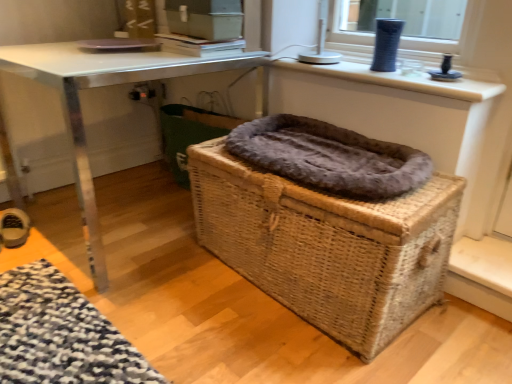
I want to click on free space in front of fuzzy brown laundry basket at center, so click(162, 233).